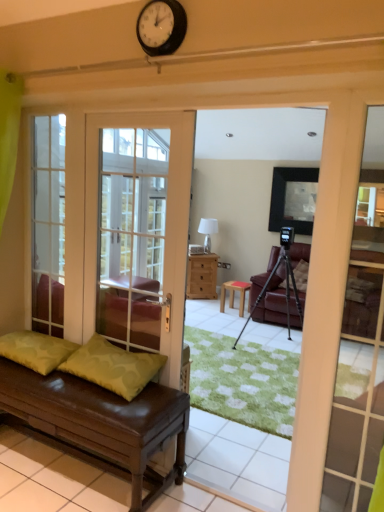
Where is `free space in front of green textured pillow at lower left, the first pillow positioned from the left`? This screenshot has height=512, width=384. free space in front of green textured pillow at lower left, the first pillow positioned from the left is located at coordinates (39, 379).